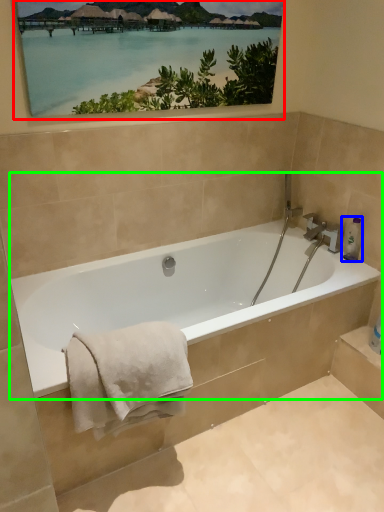
Question: Which is farther away from picture frame (highlighted by a red box)? toiletry (highlighted by a blue box) or bathtub (highlighted by a green box)?

Choices:
 (A) toiletry
 (B) bathtub

Answer: (A)